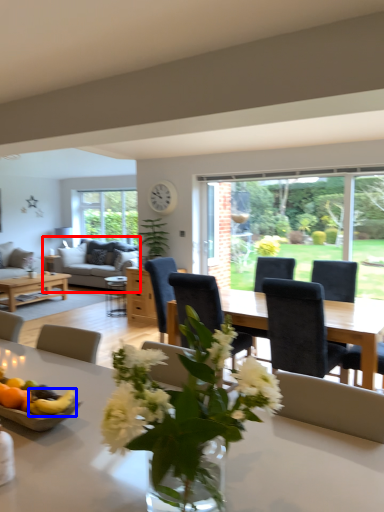
Question: Which object is closer to the camera taking this photo, studio couch (highlighted by a red box) or fruit (highlighted by a blue box)?

Choices:
 (A) studio couch
 (B) fruit

Answer: (B)